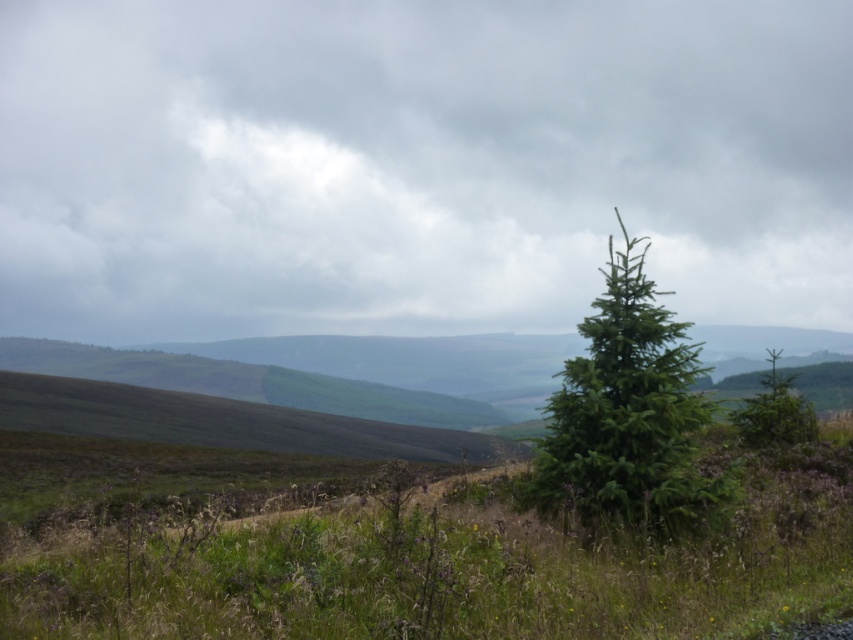
Question: Does green needle-like at center appear over green matte tree at right?

Choices:
 (A) yes
 (B) no

Answer: (A)

Question: Which point appears farthest from the camera in this image?

Choices:
 (A) (747, 426)
 (B) (666, 362)

Answer: (A)

Question: Is green needle-like at center closer to the viewer compared to green matte tree at right?

Choices:
 (A) no
 (B) yes

Answer: (B)

Question: Which point is farther to the camera?

Choices:
 (A) green matte tree at right
 (B) green needle-like at center

Answer: (A)

Question: Which point appears closest to the camera in this image?

Choices:
 (A) (788, 376)
 (B) (581, 512)

Answer: (B)

Question: Can you confirm if green needle-like at center is bigger than green matte tree at right?

Choices:
 (A) no
 (B) yes

Answer: (A)